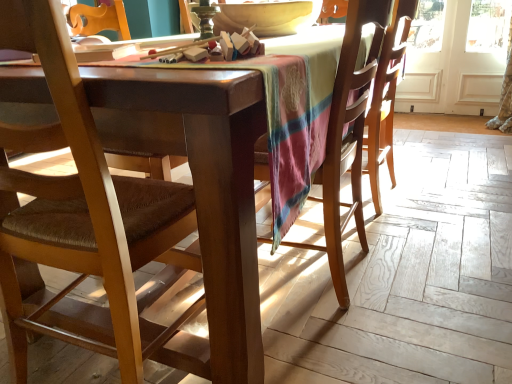
Question: From the image's perspective, would you say brown fabric chair at left, the first chair in the left-to-right sequence, is positioned over wooden chair at center, which ranks as the 2th chair in left-to-right order?

Choices:
 (A) yes
 (B) no

Answer: (B)

Question: Is brown fabric chair at left, the first chair in the left-to-right sequence, shorter than wooden chair at center, marked as the 1th chair in a right-to-left arrangement?

Choices:
 (A) no
 (B) yes

Answer: (A)

Question: Is brown fabric chair at left, the first chair in the left-to-right sequence, to the right of wooden chair at center, which ranks as the 2th chair in left-to-right order, from the viewer's perspective?

Choices:
 (A) yes
 (B) no

Answer: (B)

Question: Considering the relative sizes of brown fabric chair at left, the first chair in the left-to-right sequence, and wooden chair at center, marked as the 1th chair in a right-to-left arrangement, in the image provided, is brown fabric chair at left, the first chair in the left-to-right sequence, taller than wooden chair at center, marked as the 1th chair in a right-to-left arrangement,?

Choices:
 (A) no
 (B) yes

Answer: (B)

Question: Considering the relative sizes of brown fabric chair at left, which ranks as the second chair in right-to-left order, and wooden chair at center, which ranks as the 2th chair in left-to-right order, in the image provided, is brown fabric chair at left, which ranks as the second chair in right-to-left order, bigger than wooden chair at center, which ranks as the 2th chair in left-to-right order,?

Choices:
 (A) yes
 (B) no

Answer: (A)

Question: Can we say brown fabric chair at left, which ranks as the second chair in right-to-left order, lies outside wooden chair at center, which ranks as the 2th chair in left-to-right order?

Choices:
 (A) yes
 (B) no

Answer: (A)

Question: Is wooden chair at center, which ranks as the 2th chair in left-to-right order, in contact with brown fabric chair at left, which ranks as the second chair in right-to-left order?

Choices:
 (A) yes
 (B) no

Answer: (B)

Question: Can you confirm if wooden chair at center, which ranks as the 2th chair in left-to-right order, is positioned to the left of brown fabric chair at left, which ranks as the second chair in right-to-left order?

Choices:
 (A) yes
 (B) no

Answer: (B)

Question: Is wooden chair at center, marked as the 1th chair in a right-to-left arrangement, facing away from brown fabric chair at left, which ranks as the second chair in right-to-left order?

Choices:
 (A) yes
 (B) no

Answer: (B)

Question: Does wooden chair at center, which ranks as the 2th chair in left-to-right order, have a smaller size compared to brown fabric chair at left, the first chair in the left-to-right sequence?

Choices:
 (A) yes
 (B) no

Answer: (A)

Question: Can you confirm if wooden chair at center, which ranks as the 2th chair in left-to-right order, is bigger than brown fabric chair at left, the first chair in the left-to-right sequence?

Choices:
 (A) yes
 (B) no

Answer: (B)

Question: Would you say wooden chair at center, which ranks as the 2th chair in left-to-right order, is a long distance from brown fabric chair at left, which ranks as the second chair in right-to-left order?

Choices:
 (A) yes
 (B) no

Answer: (B)

Question: From a real-world perspective, is matte yellow bowl at upper center physically above white wood screen door at upper right?

Choices:
 (A) yes
 (B) no

Answer: (A)